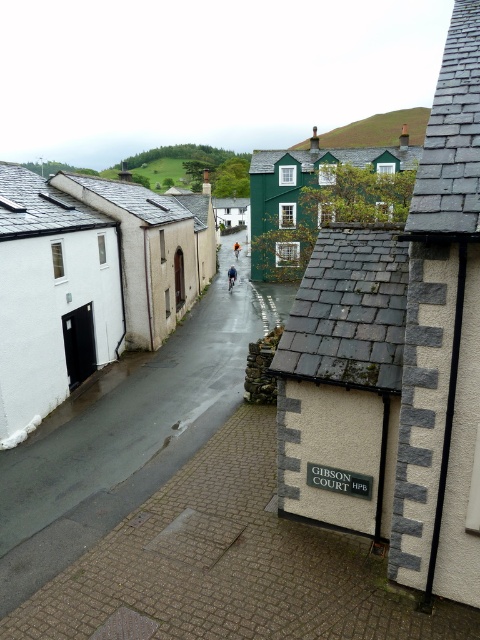
You are standing at the entrance of the white building with a dark gray roof on the left side of the street. Which direction should you walk to reach the smooth asphalt road at center?

The smooth asphalt road at center is located at point coordinates, so you should walk towards the center of the street to reach it.